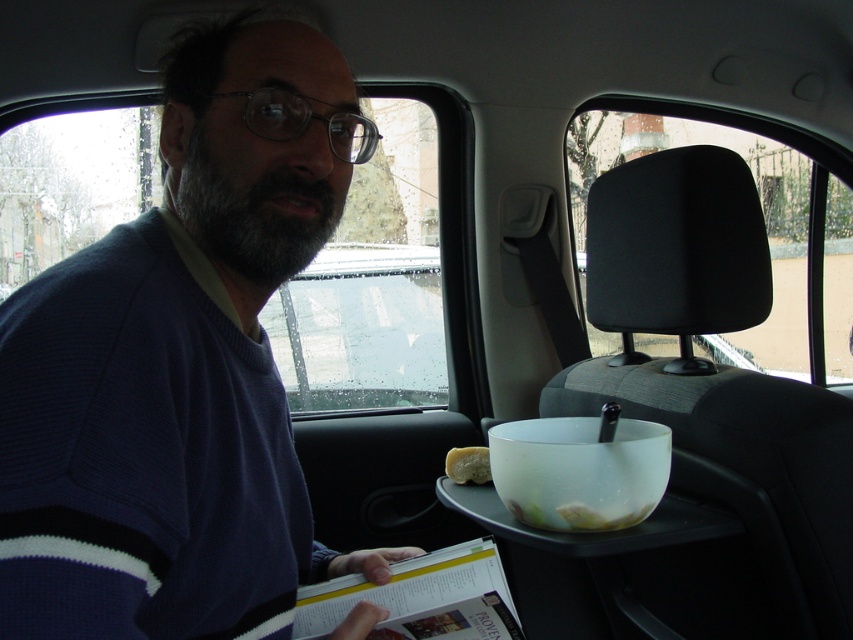
Can you confirm if dark blue sweater at left is positioned below white matte bread at center?

Actually, dark blue sweater at left is above white matte bread at center.

Is dark blue sweater at left shorter than white matte bread at center?

No, dark blue sweater at left is not shorter than white matte bread at center.

Which is in front, point (131, 616) or point (480, 458)?

Point (131, 616) is in front.

Find the location of a particular element. The image size is (853, 640). dark blue sweater at left is located at coordinates (180, 365).